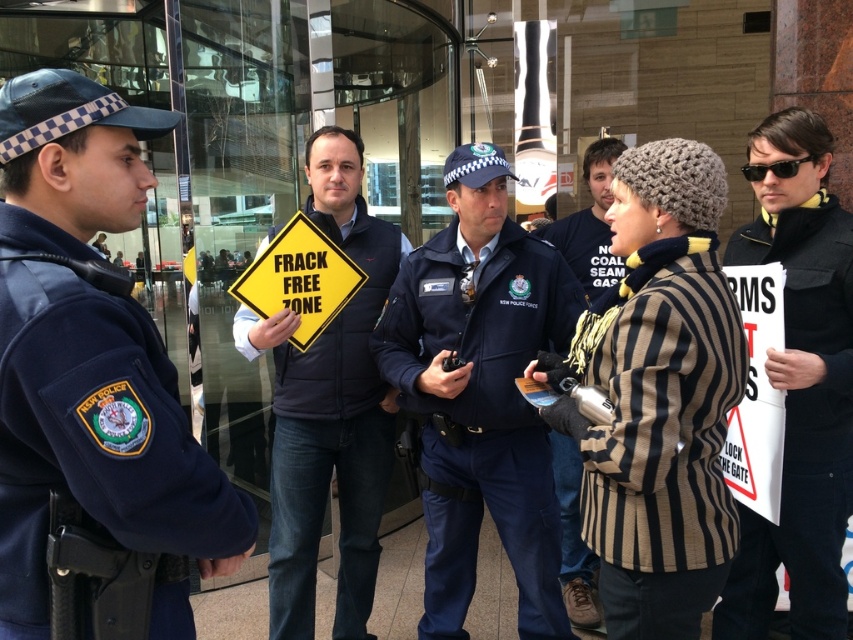
You are a photographer standing at the front of the scene. You want to take a photo that includes both the navy blue uniform at left and the yellow diamond sign at center. Which object should you adjust your camera angle to focus on first to ensure both are in frame?

The navy blue uniform at left is closer to the viewer than the yellow diamond sign at center, so you should focus on the navy blue uniform at left first to ensure both are in frame.

You are a photographer trying to capture a photo of the protest scene. You notice two points marked in the image at coordinates point (770, 253) and point (369, 276). Which point is closer to the camera based on their positions?

Point (770, 253) is in front of point (369, 276), so it is closer to the camera.